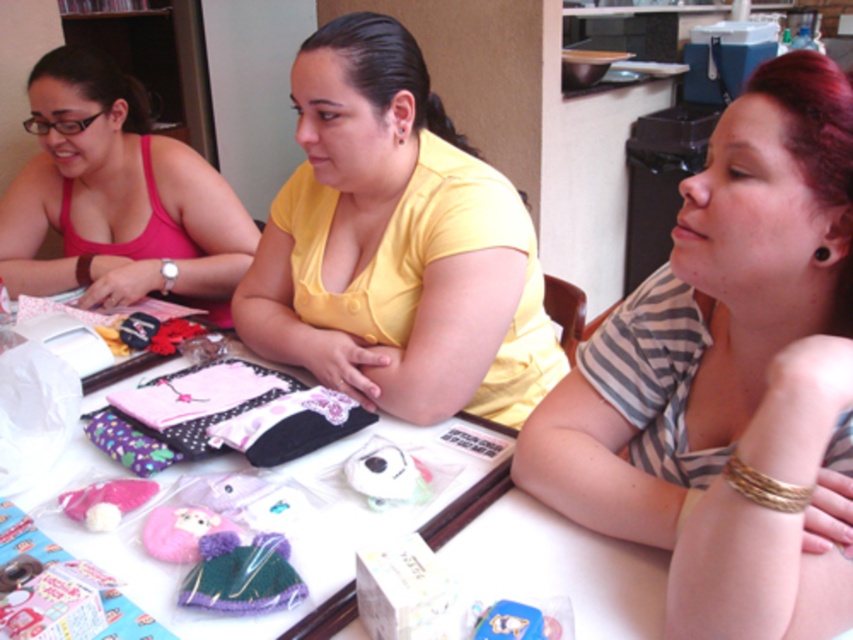
Question: Is yellow matte shirt at center positioned before brown leather bracelet at upper left?

Choices:
 (A) yes
 (B) no

Answer: (A)

Question: Is yellow matte shirt at center below silver metallic watch at upper left?

Choices:
 (A) yes
 (B) no

Answer: (B)

Question: Is striped fabric shirt at upper right in front of yellow matte shirt at center?

Choices:
 (A) no
 (B) yes

Answer: (B)

Question: Which point is closer to the camera taking this photo?

Choices:
 (A) (169, 282)
 (B) (810, 490)
 (C) (817, 248)

Answer: (B)

Question: Which of the following is the closest to the observer?

Choices:
 (A) (86, 285)
 (B) (172, 282)
 (C) (747, 476)
 (D) (219, 186)

Answer: (C)

Question: Considering the real-world distances, which object is closest to the striped fabric shirt at upper right?

Choices:
 (A) pink fabric top at left
 (B) gold metallic bracelet at lower right

Answer: (B)